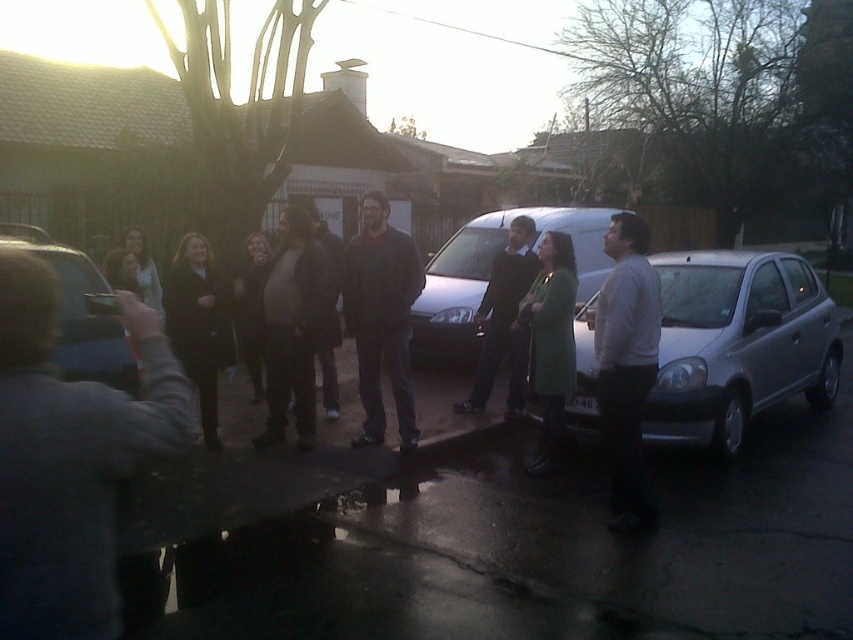
Identify the location of gray sweater at center. This screenshot has height=640, width=853. tap(625, 364).

The height and width of the screenshot is (640, 853). Describe the element at coordinates (625, 364) in the screenshot. I see `gray sweater at center` at that location.

Find the location of `gray sweater at center`. gray sweater at center is located at coordinates (625, 364).

At what (x,y) coordinates should I click in order to perform the action: click on gray sweater at center. Please return your answer as a coordinate pair (x, y). The height and width of the screenshot is (640, 853). Looking at the image, I should click on (625, 364).

From the picture: Which is more to the left, dark gray jacket at center or black wool coat at center?

From the viewer's perspective, black wool coat at center appears more on the left side.

The height and width of the screenshot is (640, 853). What do you see at coordinates (381, 317) in the screenshot?
I see `dark gray jacket at center` at bounding box center [381, 317].

Identify the location of dark gray jacket at center. This screenshot has height=640, width=853. (381, 317).

Looking at this image, is gray fabric at left above black wool coat at center?

No, gray fabric at left is not above black wool coat at center.

Which is in front, point (50, 436) or point (189, 260)?

Point (50, 436) is in front.

Locate an element on the screen. This screenshot has height=640, width=853. gray fabric at left is located at coordinates (71, 458).